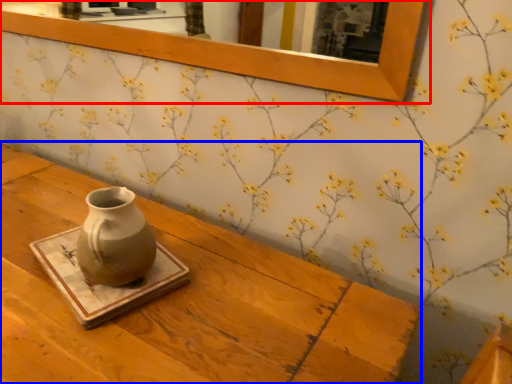
Question: Which object is closer to the camera taking this photo, picture frame (highlighted by a red box) or table (highlighted by a blue box)?

Choices:
 (A) picture frame
 (B) table

Answer: (B)